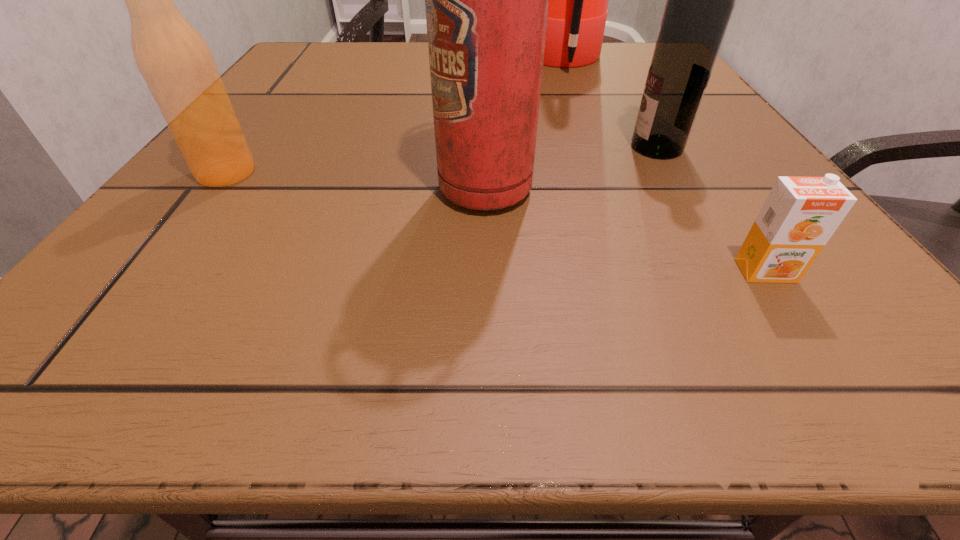
Locate an element on the screen. The height and width of the screenshot is (540, 960). free space at the far left corner is located at coordinates (361, 59).

Image resolution: width=960 pixels, height=540 pixels. In the image, there is a desktop. Find the location of `free space at the far right corner`. free space at the far right corner is located at coordinates (643, 72).

This screenshot has height=540, width=960. In the image, there is a desktop. In order to click on blank space at the near right corner in this screenshot , I will do `click(892, 316)`.

Identify the location of vacant region between the alcohol and the fourth shortest object. (571, 168).

Image resolution: width=960 pixels, height=540 pixels. I want to click on free area in between the farther fire extinguisher and the orange juice, so click(664, 166).

Image resolution: width=960 pixels, height=540 pixels. Find the location of `free space between the beer bottle and the second tallest object`. free space between the beer bottle and the second tallest object is located at coordinates (356, 181).

The width and height of the screenshot is (960, 540). Identify the location of vacant area between the shortest object and the second object from left to right. (625, 230).

Identify the location of free space between the leftmost object and the nearest object. This screenshot has height=540, width=960. [x=496, y=222].

Where is `free area in between the third shortest object and the nearest object`? The width and height of the screenshot is (960, 540). free area in between the third shortest object and the nearest object is located at coordinates (711, 209).

Locate an element on the screen. object that can be found as the closest to the leftmost object is located at coordinates click(x=486, y=0).